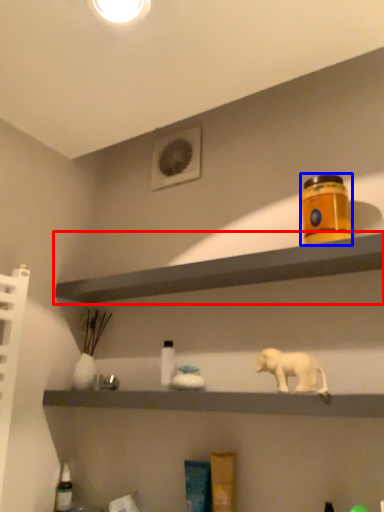
Question: Which of the following is the farthest to the observer, shelf (highlighted by a red box) or product (highlighted by a blue box)?

Choices:
 (A) shelf
 (B) product

Answer: (B)